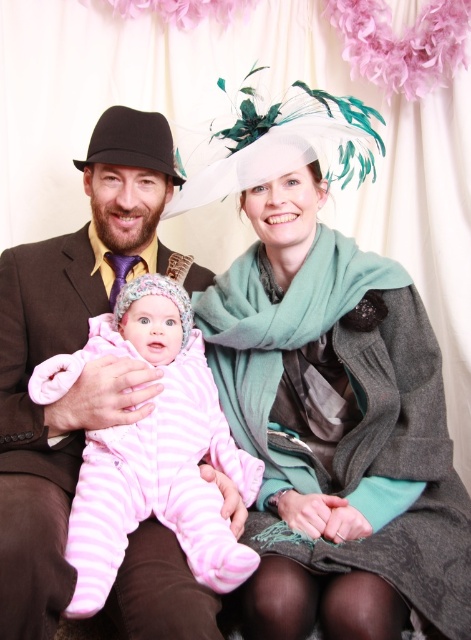
You are a photographer trying to capture a closeup of the white matte hat at upper center without the pink fleece onesie at center showing in the frame. Is this possible given their positions?

The white matte hat at upper center is positioned over the pink fleece onesie at center, so it is possible to capture a closeup of the white matte hat at upper center without the pink fleece onesie at center showing in the frame.

You are a photographer setting up for a family portrait. You notice the white matte hat at upper center and the pink fleece onesie at center in the scene. Which object should you adjust to ensure both are visible in the frame without overlapping?

The white matte hat at upper center has a greater height compared to the pink fleece onesie at center. To prevent overlapping, adjust the position of the white matte hat at upper center since it is taller and might block the view of the pink fleece onesie at center.

Based on the scene description, what are the coordinates of the white matte hat at upper center?

The white matte hat at upper center is located at coordinates (x=331, y=397).